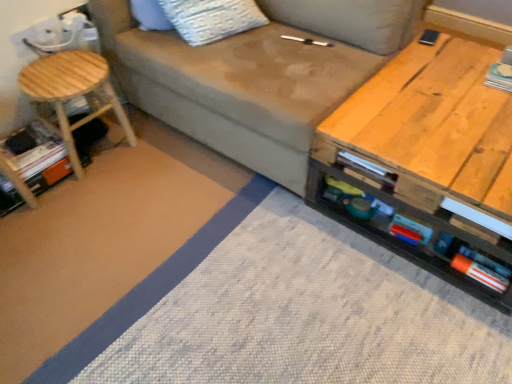
Question: From a real-world perspective, relative to matte gray fabric couch at center, is orange cardboard book at lower left, which appears as the second book when viewed from the top, vertically above or below?

Choices:
 (A) below
 (B) above

Answer: (A)

Question: From the image's perspective, is orange cardboard book at lower left, which appears as the second book when viewed from the top, located above or below matte gray fabric couch at center?

Choices:
 (A) above
 (B) below

Answer: (B)

Question: Based on their relative distances, which object is nearer to the matte gray fabric couch at center?

Choices:
 (A) white paper book at upper right, positioned as the 2th book in bottom-to-top order
 (B) natural wood stool at left
 (C) wooden table at right
 (D) orange cardboard book at lower left, the 1th book in the left-to-right sequence

Answer: (C)

Question: Based on their relative distances, which object is nearer to the wooden table at right?

Choices:
 (A) matte gray fabric couch at center
 (B) natural wood stool at left
 (C) white paper book at upper right, which is counted as the 1th book, starting from the right
 (D) orange cardboard book at lower left, marked as the first book in a bottom-to-top arrangement

Answer: (A)